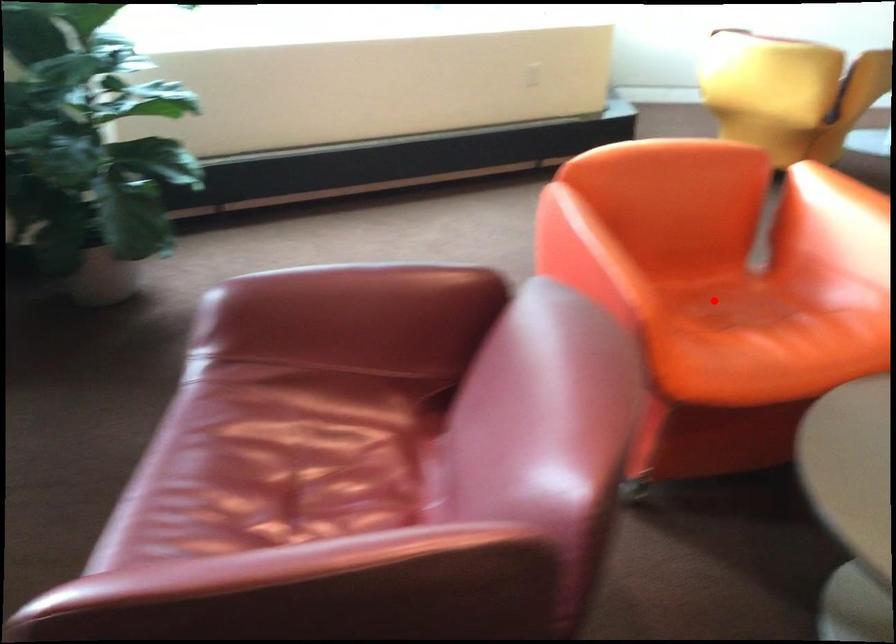
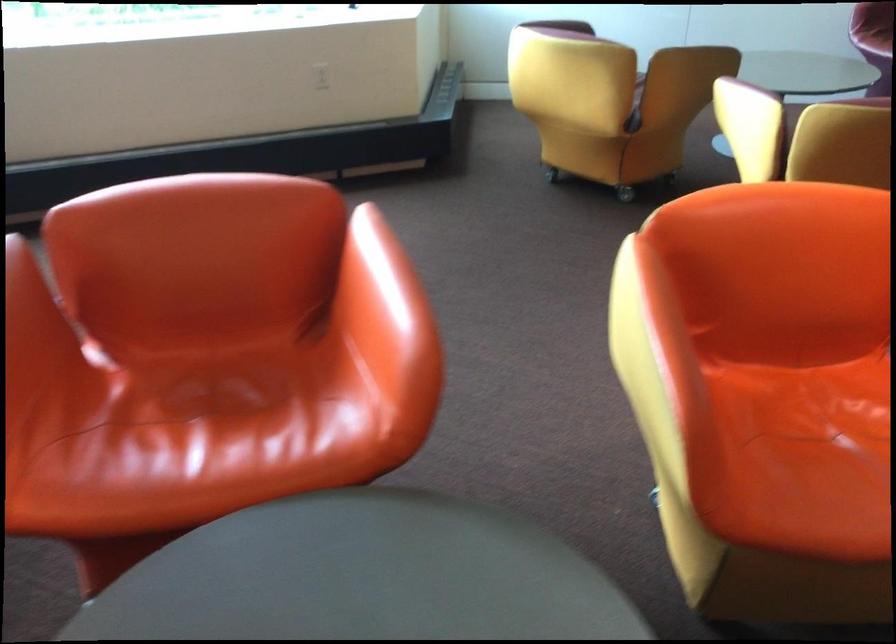
Question: A red point is marked in image1. In image2, is the corresponding 3D point closer to the camera or farther? Reply with the corresponding letter.

Choices:
 (A) The corresponding 3D point is closer.
 (B) The corresponding 3D point is farther.

Answer: (A)